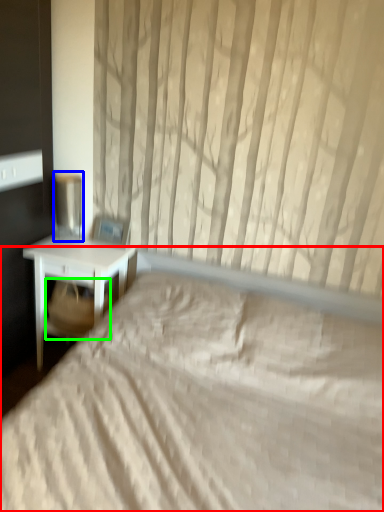
Question: Which is farther away from bed (highlighted by a red box)? table lamp (highlighted by a blue box) or swivel chair (highlighted by a green box)?

Choices:
 (A) table lamp
 (B) swivel chair

Answer: (A)